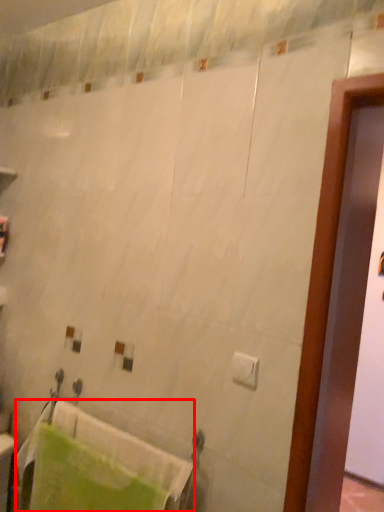
Question: From the image's perspective, considering the relative positions of bath towel (annotated by the red box) and toilet paper in the image provided, where is bath towel (annotated by the red box) located with respect to the staircase?

Choices:
 (A) above
 (B) below

Answer: (B)